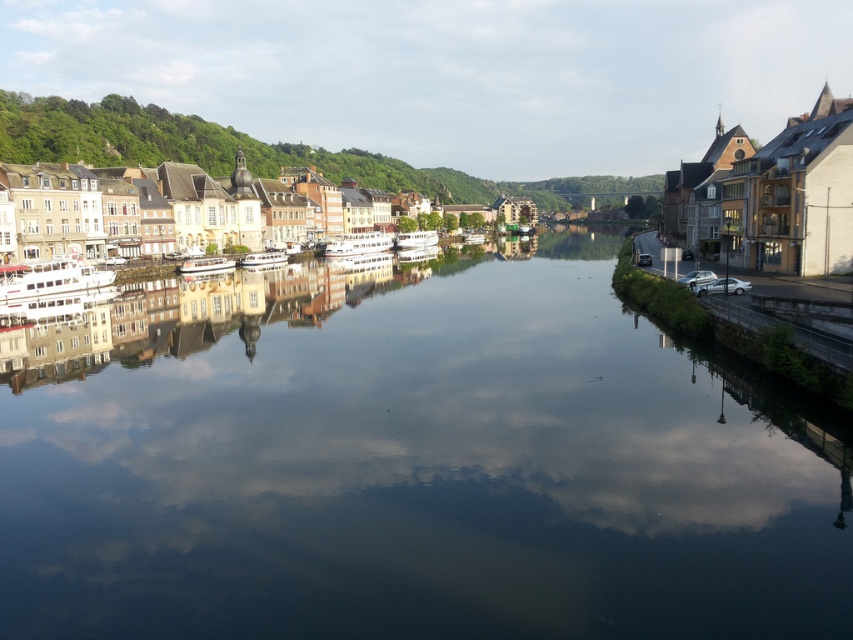
You are standing at the center of the image. Which direction should you walk to reach the matte yellow building at left?

You should walk to the left to reach the matte yellow building at left since it is located at the left side of the image.

You are standing on the riverside and want to take a photo of the smooth reflective water at center. Where should you position yourself to capture it?

You should position yourself at point (x=409, y=464) to capture the smooth reflective water at center.